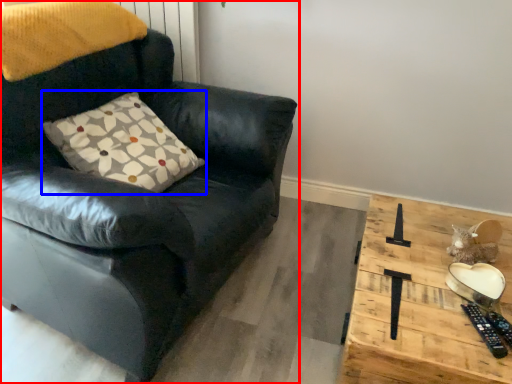
Question: Which point is closer to the camera, chair (highlighted by a red box) or pillow (highlighted by a blue box)?

Choices:
 (A) chair
 (B) pillow

Answer: (A)